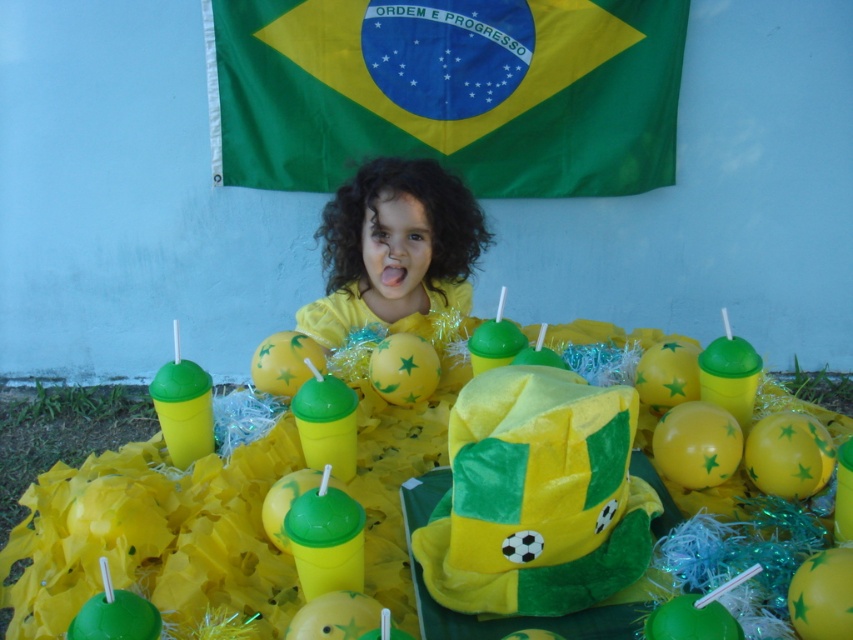
Consider the image. Which is below, green fabric flag at upper center or yellow matte shirt at center?

yellow matte shirt at center is below.

Who is higher up, green fabric flag at upper center or yellow matte shirt at center?

green fabric flag at upper center is above.

Is point (366, 32) positioned before point (378, 259)?

No.

This screenshot has width=853, height=640. Identify the location of green fabric flag at upper center. (451, 90).